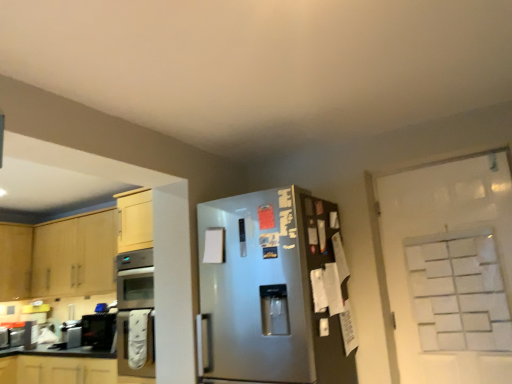
What do you see at coordinates (269, 291) in the screenshot? This screenshot has width=512, height=384. I see `satin silver refrigerator at center` at bounding box center [269, 291].

How much space does brushed metal toaster at lower left, placed as the second appliance when sorted from front to back, occupy horizontally?

8.91 inches.

This screenshot has height=384, width=512. I want to click on brushed metal toaster at lower left, placed as the second appliance when sorted from front to back, so (4, 338).

Where is `white matte glass door at upper right`? white matte glass door at upper right is located at coordinates (458, 292).

Identify the location of light wood cabinet at left, which ranks as the 1th cabinetry in top-to-bottom order. (60, 256).

At what (x,y) coordinates should I click in order to perform the action: click on brushed metal toaster at lower left, the 2th appliance viewed from the back. Please return your answer as a coordinate pair (x, y). Looking at the image, I should click on (71, 334).

Measure the distance between point (7, 378) and camera.

Point (7, 378) is 3.76 meters from camera.

Find the location of a particular element. The width and height of the screenshot is (512, 384). satin silver refrigerator at center is located at coordinates (269, 291).

In the scene shown: Are brushed metal toaster at lower left, which is the 1th appliance from left to right, and matte white cabinets at lower left, which is counted as the first cabinetry, starting from the bottom, located far from each other?

Actually, brushed metal toaster at lower left, which is the 1th appliance from left to right, and matte white cabinets at lower left, which is counted as the first cabinetry, starting from the bottom, are a little close together.

Would you say brushed metal toaster at lower left, which appears as the second appliance when viewed from the right, is outside matte white cabinets at lower left, which ranks as the second cabinetry in top-to-bottom order?

Indeed, brushed metal toaster at lower left, which appears as the second appliance when viewed from the right, is completely outside matte white cabinets at lower left, which ranks as the second cabinetry in top-to-bottom order.

At what (x,y) coordinates should I click in order to perform the action: click on cabinetry below the brushed metal toaster at lower left, which appears as the second appliance when viewed from the right (from a real-world perspective). Please return your answer as a coordinate pair (x, y). Looking at the image, I should click on (62, 367).

Does brushed metal toaster at lower left, which is the 1th appliance from back to front, turn towards matte white cabinets at lower left, which ranks as the second cabinetry in top-to-bottom order?

No, brushed metal toaster at lower left, which is the 1th appliance from back to front, is not facing towards matte white cabinets at lower left, which ranks as the second cabinetry in top-to-bottom order.

How many degrees apart are the facing directions of white paperboard at right and satin silver refrigerator at center?

The angular difference between white paperboard at right and satin silver refrigerator at center is 4.24 degrees.

Which is further, (470,216) or (247,261)?

The point (470,216) is farther.

Is white paperboard at right next to satin silver refrigerator at center and touching it?

They are not placed beside each other.

In the scene shown: Is white paperboard at right wider or thinner than satin silver refrigerator at center?

Considering their sizes, white paperboard at right looks slimmer than satin silver refrigerator at center.

Based on the photo, looking at their sizes, would you say light wood cabinet at left, which ranks as the 1th cabinetry in top-to-bottom order, is wider or thinner than satin silver refrigerator at center?

In the image, light wood cabinet at left, which ranks as the 1th cabinetry in top-to-bottom order, appears to be more narrow than satin silver refrigerator at center.

Does light wood cabinet at left, which ranks as the 1th cabinetry in top-to-bottom order, turn towards satin silver refrigerator at center?

No, light wood cabinet at left, which ranks as the 1th cabinetry in top-to-bottom order, is not turned towards satin silver refrigerator at center.

Based on their sizes in the image, would you say light wood cabinet at left, which ranks as the 1th cabinetry in top-to-bottom order, is bigger or smaller than satin silver refrigerator at center?

light wood cabinet at left, which ranks as the 1th cabinetry in top-to-bottom order, is smaller than satin silver refrigerator at center.

I want to click on cabinetry that is the 2nd one when counting backward from the satin silver refrigerator at center, so click(x=60, y=256).

I want to click on refrigerator above the brushed metal toaster at lower left, which appears as the second appliance when viewed from the left (from the image's perspective), so click(x=269, y=291).

Which of these two, brushed metal toaster at lower left, which appears as the second appliance when viewed from the left, or satin silver refrigerator at center, is smaller?

With smaller size is brushed metal toaster at lower left, which appears as the second appliance when viewed from the left.

From the image's perspective, which is above, brushed metal toaster at lower left, which is the 1th appliance in front-to-back order, or satin silver refrigerator at center?

satin silver refrigerator at center appears higher in the image.

Is point (62, 335) behind point (297, 226)?

Yes, it is.

Would you say brushed metal toaster at lower left, which is the first appliance from right to left, is outside matte white cabinets at lower left, which is counted as the first cabinetry, starting from the bottom?

Absolutely, brushed metal toaster at lower left, which is the first appliance from right to left, is external to matte white cabinets at lower left, which is counted as the first cabinetry, starting from the bottom.

From a real-world perspective, is brushed metal toaster at lower left, which is the first appliance from right to left, over matte white cabinets at lower left, which is counted as the first cabinetry, starting from the bottom?

Yes, from a real-world perspective, brushed metal toaster at lower left, which is the first appliance from right to left, is over matte white cabinets at lower left, which is counted as the first cabinetry, starting from the bottom

Does brushed metal toaster at lower left, the 2th appliance viewed from the back, touch matte white cabinets at lower left, which ranks as the second cabinetry in top-to-bottom order?

No, brushed metal toaster at lower left, the 2th appliance viewed from the back, is not touching matte white cabinets at lower left, which ranks as the second cabinetry in top-to-bottom order.

How many degrees apart are the facing directions of brushed metal toaster at lower left, which is the 1th appliance in front-to-back order, and matte white cabinets at lower left, which is counted as the first cabinetry, starting from the bottom?

3.51 degrees.

Is white matte glass door at upper right facing away from brushed metal toaster at lower left, which appears as the second appliance when viewed from the left?

No, white matte glass door at upper right is not facing the opposite direction of brushed metal toaster at lower left, which appears as the second appliance when viewed from the left.

In the scene shown: Is white matte glass door at upper right wider or thinner than brushed metal toaster at lower left, the 2th appliance viewed from the back?

Considering their sizes, white matte glass door at upper right looks slimmer than brushed metal toaster at lower left, the 2th appliance viewed from the back.

Can you confirm if white matte glass door at upper right is bigger than brushed metal toaster at lower left, which is the 1th appliance in front-to-back order?

Yes, white matte glass door at upper right is bigger than brushed metal toaster at lower left, which is the 1th appliance in front-to-back order.

From a real-world perspective, is white matte glass door at upper right located beneath brushed metal toaster at lower left, which is the 1th appliance in front-to-back order?

No, from a real-world perspective, white matte glass door at upper right is not under brushed metal toaster at lower left, which is the 1th appliance in front-to-back order.

Between satin silver refrigerator at center and matte white cabinets at lower left, which ranks as the second cabinetry in top-to-bottom order, which one has larger width?

satin silver refrigerator at center.

Would you say satin silver refrigerator at center is outside matte white cabinets at lower left, which ranks as the second cabinetry in top-to-bottom order?

satin silver refrigerator at center is positioned outside matte white cabinets at lower left, which ranks as the second cabinetry in top-to-bottom order.

Considering the sizes of objects satin silver refrigerator at center and matte white cabinets at lower left, which ranks as the second cabinetry in top-to-bottom order, in the image provided, who is bigger, satin silver refrigerator at center or matte white cabinets at lower left, which ranks as the second cabinetry in top-to-bottom order,?

satin silver refrigerator at center is bigger.

Can you confirm if satin silver refrigerator at center is positioned to the left of matte white cabinets at lower left, which ranks as the second cabinetry in top-to-bottom order?

No, satin silver refrigerator at center is not to the left of matte white cabinets at lower left, which ranks as the second cabinetry in top-to-bottom order.

Locate an element on the screen. Image resolution: width=512 pixels, height=384 pixels. cabinetry beneath the brushed metal toaster at lower left, which appears as the second appliance when viewed from the right (from a real-world perspective) is located at coordinates (62, 367).

The width and height of the screenshot is (512, 384). In order to click on door above the satin silver refrigerator at center (from a real-world perspective) in this screenshot , I will do `click(449, 270)`.

Estimate the real-world distances between objects in this image. Which object is further from brushed metal toaster at lower left, placed as the second appliance when sorted from front to back, matte white cabinets at lower left, which ranks as the second cabinetry in top-to-bottom order, or satin silver refrigerator at center?

satin silver refrigerator at center is further to brushed metal toaster at lower left, placed as the second appliance when sorted from front to back.

When comparing their distances from light wood cabinet at left, which is the second cabinetry in bottom-to-top order, does brushed metal toaster at lower left, which appears as the second appliance when viewed from the right, or brushed metal toaster at lower left, which appears as the second appliance when viewed from the left, seem closer?

Among the two, brushed metal toaster at lower left, which appears as the second appliance when viewed from the left, is located nearer to light wood cabinet at left, which is the second cabinetry in bottom-to-top order.

When comparing their distances from white paperboard at right, does brushed metal toaster at lower left, placed as the second appliance when sorted from front to back, or brushed metal toaster at lower left, the 2th appliance viewed from the back, seem closer?

Based on the image, brushed metal toaster at lower left, the 2th appliance viewed from the back, appears to be nearer to white paperboard at right.

Looking at the image, which one is located further to white matte glass door at upper right, satin silver refrigerator at center or light wood cabinet at left, which ranks as the 1th cabinetry in top-to-bottom order?

light wood cabinet at left, which ranks as the 1th cabinetry in top-to-bottom order.

From the image, which object appears to be nearer to brushed metal toaster at lower left, which is the 1th appliance from back to front, brushed metal toaster at lower left, which is the first appliance from right to left, or white paperboard at right?

brushed metal toaster at lower left, which is the first appliance from right to left, is closer to brushed metal toaster at lower left, which is the 1th appliance from back to front.

Considering their positions, is light wood cabinet at left, which ranks as the 1th cabinetry in top-to-bottom order, positioned closer to brushed metal toaster at lower left, which appears as the second appliance when viewed from the right, than satin silver refrigerator at center?

light wood cabinet at left, which ranks as the 1th cabinetry in top-to-bottom order, is closer to brushed metal toaster at lower left, which appears as the second appliance when viewed from the right.

Consider the image. Looking at the image, which one is located further to white paperboard at right, satin silver refrigerator at center or white matte glass door at upper right?

The object further to white paperboard at right is satin silver refrigerator at center.

Estimate the real-world distances between objects in this image. Which object is closer to brushed metal toaster at lower left, which is the 1th appliance from left to right, satin silver refrigerator at center or white paperboard at right?

Based on the image, satin silver refrigerator at center appears to be nearer to brushed metal toaster at lower left, which is the 1th appliance from left to right.

This screenshot has width=512, height=384. I want to click on door between brushed metal toaster at lower left, which is the 1th appliance from back to front, and white matte glass door at upper right, in the horizontal direction, so click(x=449, y=270).

Identify the location of cabinetry situated between brushed metal toaster at lower left, placed as the second appliance when sorted from front to back, and matte white cabinets at lower left, which is counted as the first cabinetry, starting from the bottom, from left to right. This screenshot has height=384, width=512. (60, 256).

At what (x,y) coordinates should I click in order to perform the action: click on appliance located between light wood cabinet at left, which is the second cabinetry in bottom-to-top order, and satin silver refrigerator at center in the left-right direction. Please return your answer as a coordinate pair (x, y). This screenshot has height=384, width=512. Looking at the image, I should click on (71, 334).

Locate an element on the screen. This screenshot has height=384, width=512. cabinetry between light wood cabinet at left, which ranks as the 1th cabinetry in top-to-bottom order, and satin silver refrigerator at center, in the horizontal direction is located at coordinates coord(62,367).